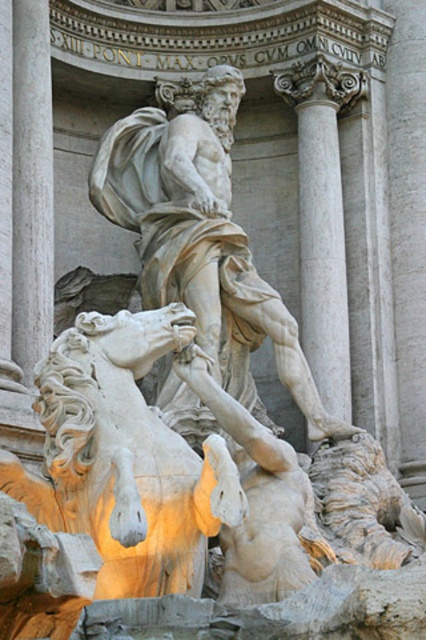
Which is below, white marble lion at lower center or white marble column at upper center?

white marble lion at lower center

The height and width of the screenshot is (640, 426). Identify the location of white marble lion at lower center. pos(124,458).

Where is `white marble lion at lower center`? The height and width of the screenshot is (640, 426). white marble lion at lower center is located at coordinates (124, 458).

Does white marble statue at center have a larger size compared to white marble column at upper center?

Yes, white marble statue at center is bigger than white marble column at upper center.

Is white marble statue at center wider than white marble column at upper center?

Yes, white marble statue at center is wider than white marble column at upper center.

Which is in front, point (244, 260) or point (331, 376)?

Point (244, 260) is more forward.

Identify the location of white marble statue at center. (201, 236).

The image size is (426, 640). What do you see at coordinates (124, 458) in the screenshot?
I see `white marble lion at lower center` at bounding box center [124, 458].

Is point (123, 536) closer to viewer compared to point (190, 259)?

Yes.

This screenshot has width=426, height=640. I want to click on white marble lion at lower center, so click(124, 458).